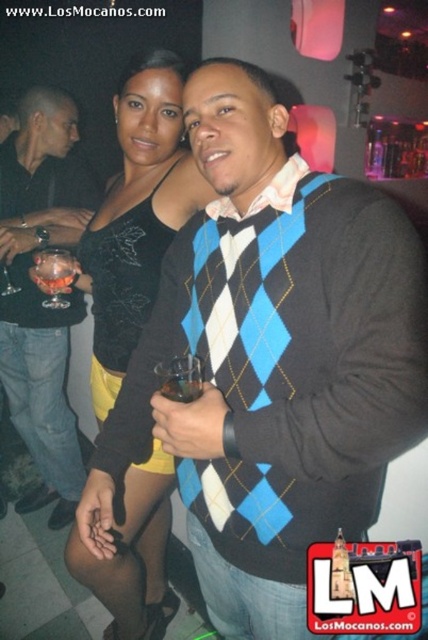
Question: Which point is closer to the camera?

Choices:
 (A) translucent glass cup at center
 (B) translucent glass at upper left
 (C) transparent glass at upper left

Answer: (A)

Question: Is matte black shirt at left positioned before translucent glass cup at center?

Choices:
 (A) yes
 (B) no

Answer: (B)

Question: Which point appears closest to the camera in this image?

Choices:
 (A) (59, 307)
 (B) (187, 364)

Answer: (B)

Question: Which point is closer to the camera taking this photo?

Choices:
 (A) (145, 161)
 (B) (174, 392)
 (C) (166, 394)

Answer: (B)

Question: Can you confirm if translucent glass at center is positioned to the left of translucent glass at upper left?

Choices:
 (A) no
 (B) yes

Answer: (A)

Question: Is transparent glass at upper left to the left of translucent glass at upper left from the viewer's perspective?

Choices:
 (A) yes
 (B) no

Answer: (A)